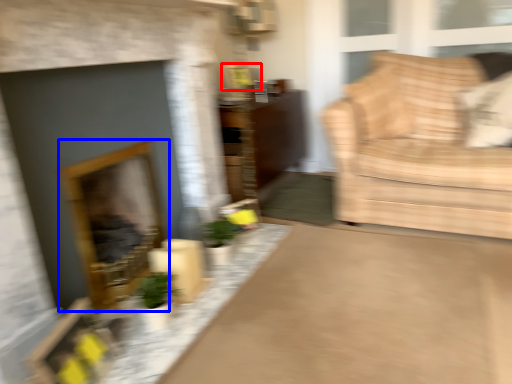
Question: Which of the following is the closest to the observer, picture frame (highlighted by a red box) or fireplace (highlighted by a blue box)?

Choices:
 (A) picture frame
 (B) fireplace

Answer: (B)